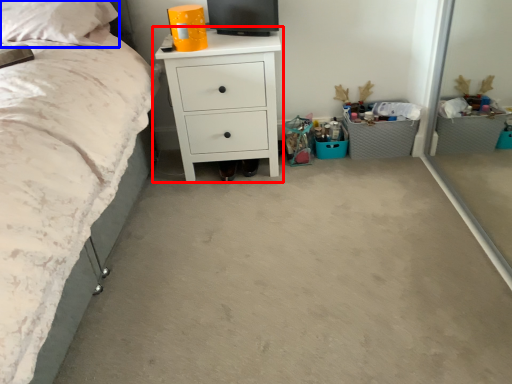
Question: Among these objects, which one is farthest to the camera, chest of drawers (highlighted by a red box) or pillow (highlighted by a blue box)?

Choices:
 (A) chest of drawers
 (B) pillow

Answer: (A)